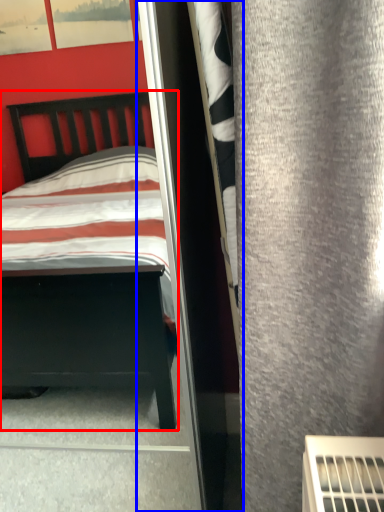
Question: Which of the following is the closest to the observer, bed (highlighted by a red box) or screen door (highlighted by a blue box)?

Choices:
 (A) bed
 (B) screen door

Answer: (A)